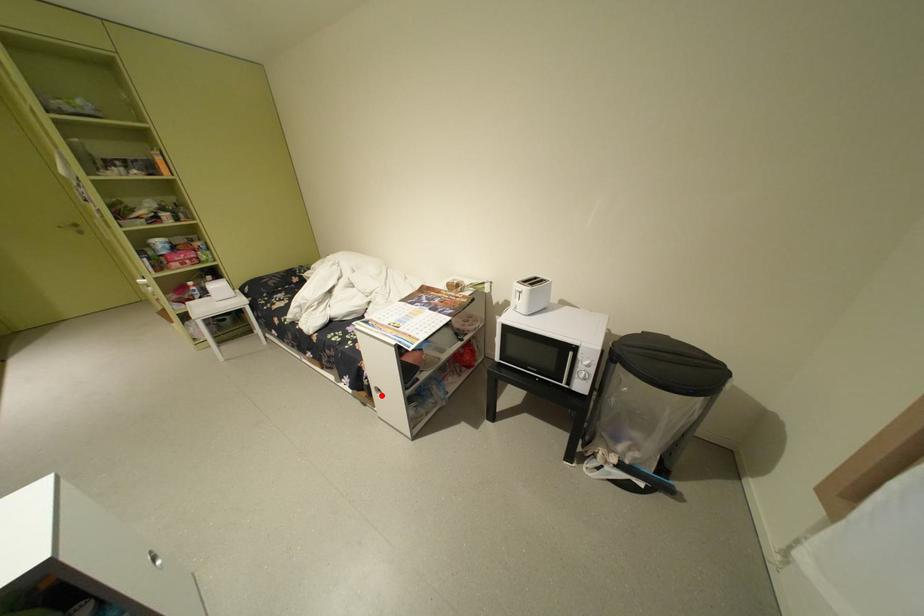
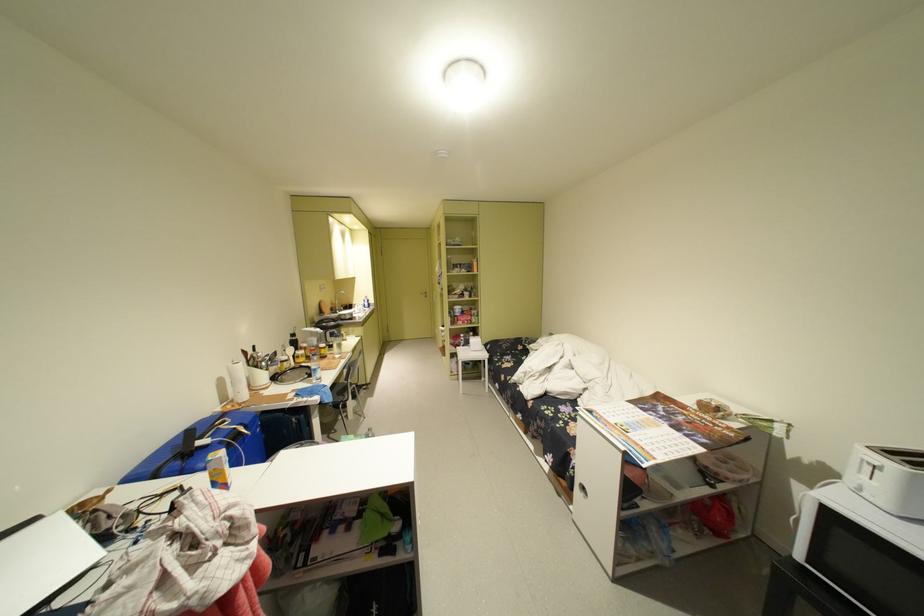
Question: I am providing you with two images of the same scene from different viewpoints. Image1 has a red point marked. In image2, the corresponding 3D location appears at what relative position? Reply with the corresponding letter.

Choices:
 (A) Closer
 (B) Farther

Answer: (A)